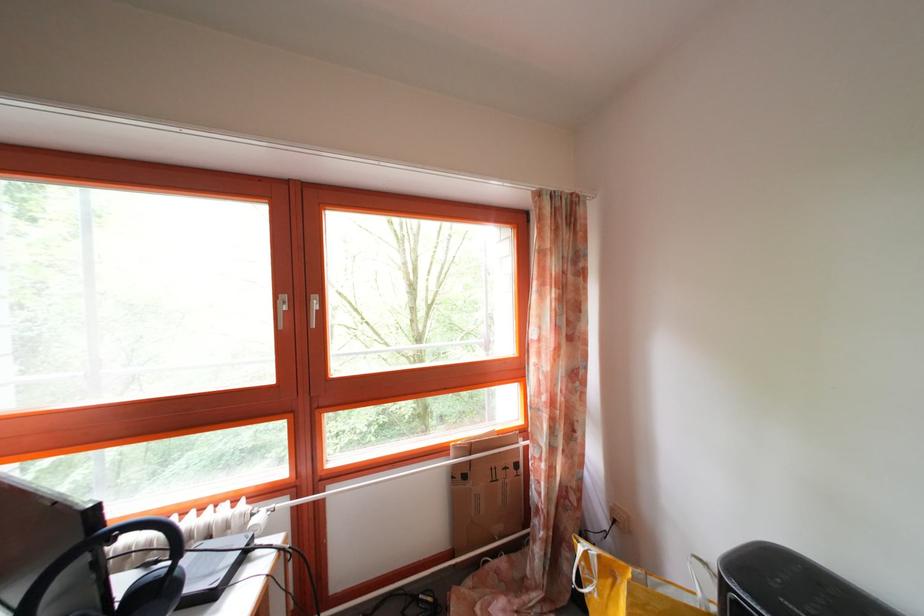
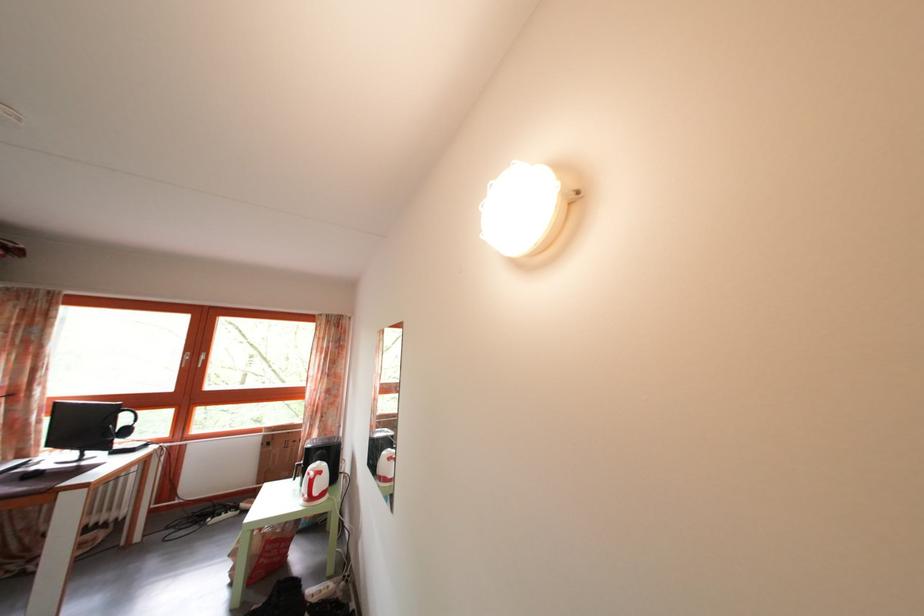
Where in the second image is the point corresponding to point 558,475 from the first image?

(317, 442)